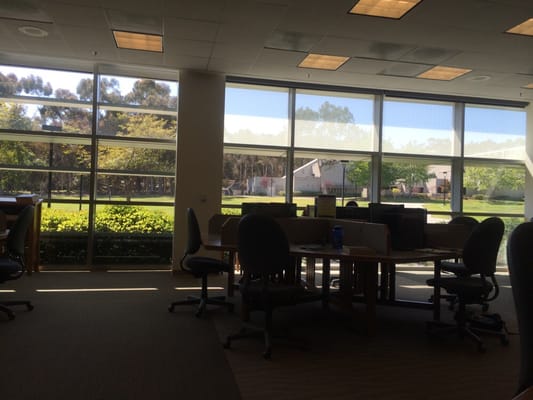
At what (x,y) coordinates should I click in order to perform the action: click on top window panes. Please return your answer as a coordinate pair (x, y). Looking at the image, I should click on (263, 116), (344, 122), (416, 129), (488, 118).